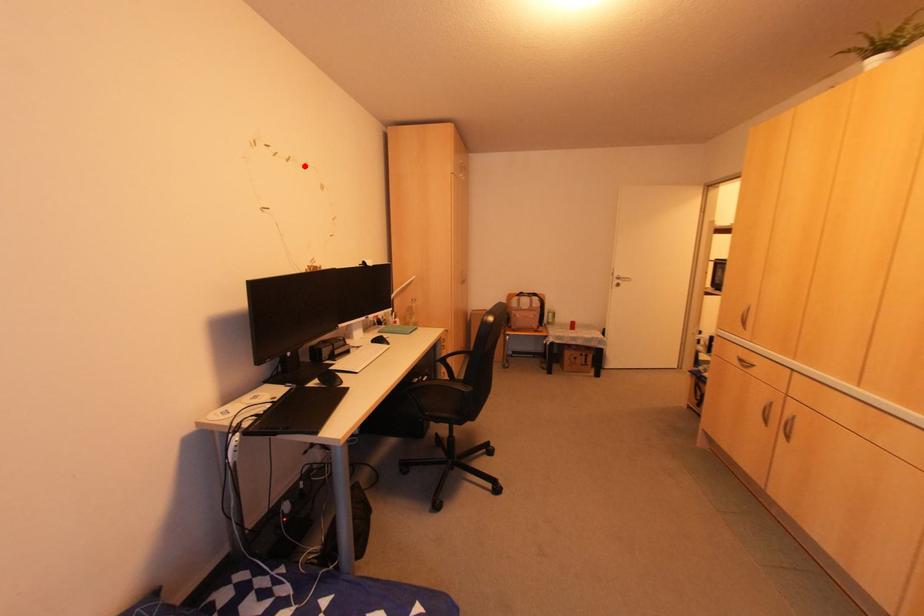
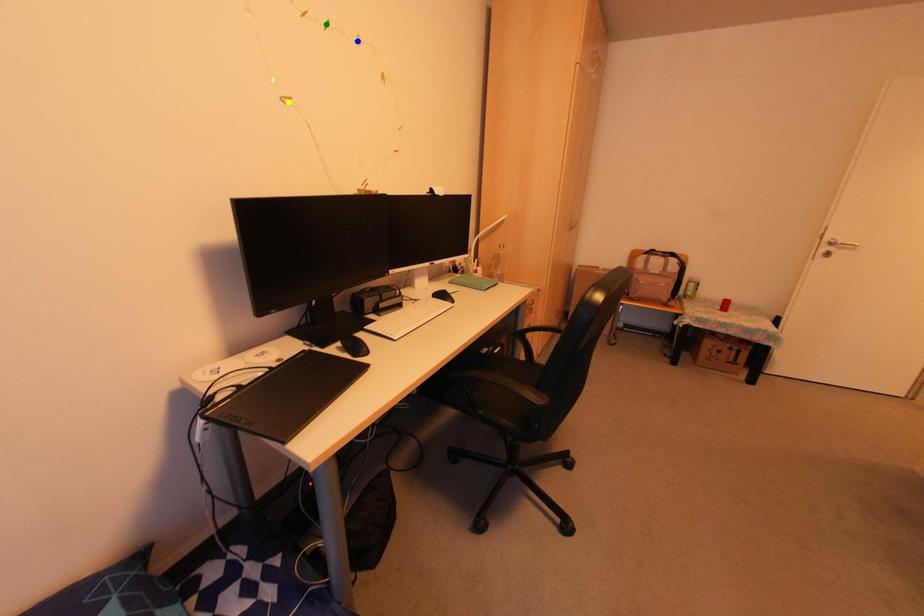
Question: I am providing you with two images of the same scene from different viewpoints. A red point is marked on the first image. You are given multiple points on the second image. Which spot in image 2 lines up with the point in image 1?

Choices:
 (A) green point
 (B) blue point
 (C) yellow point

Answer: (B)